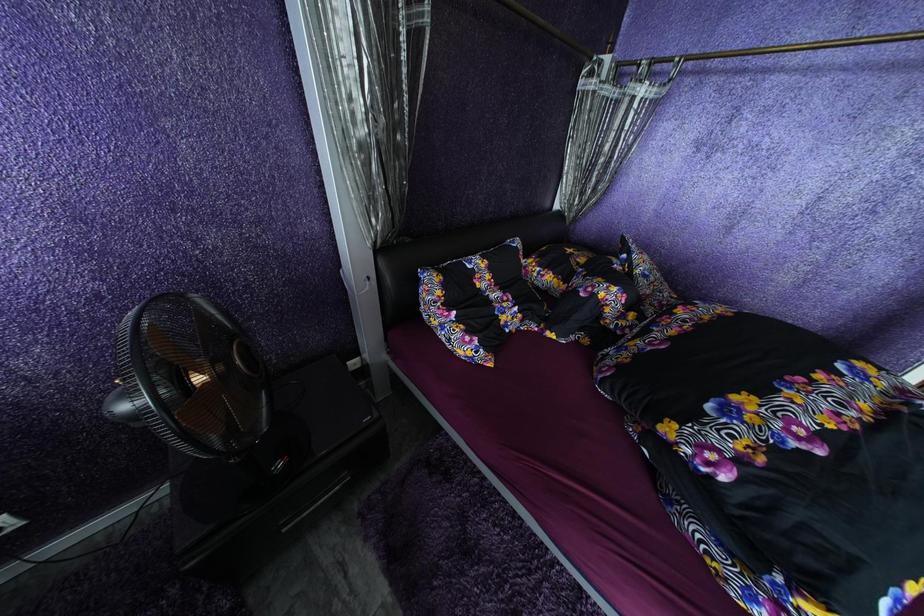
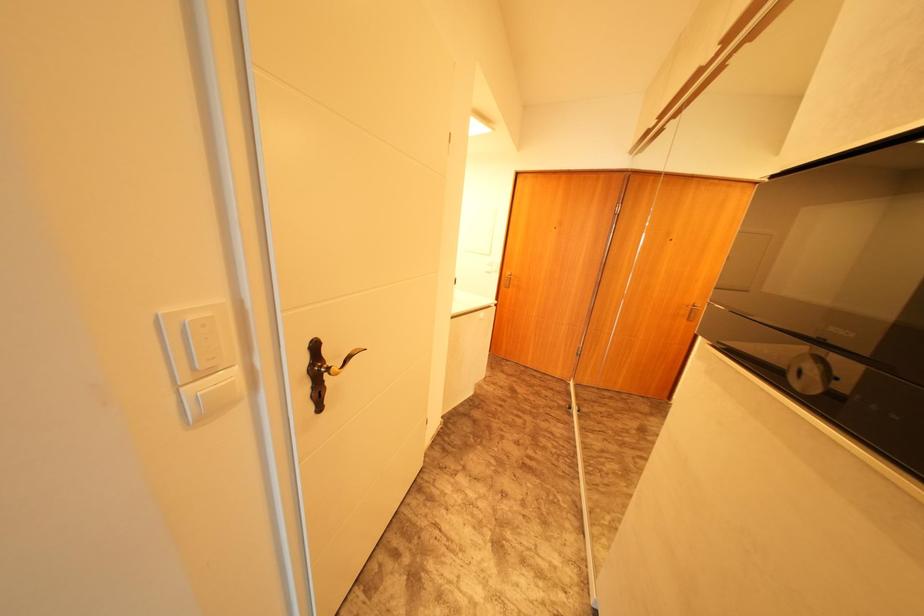
Question: Which direction would the cameraman need to move to produce the second image? Reply with the corresponding letter.

Choices:
 (A) Left
 (B) Right
 (C) Forward
 (D) Backward

Answer: (B)